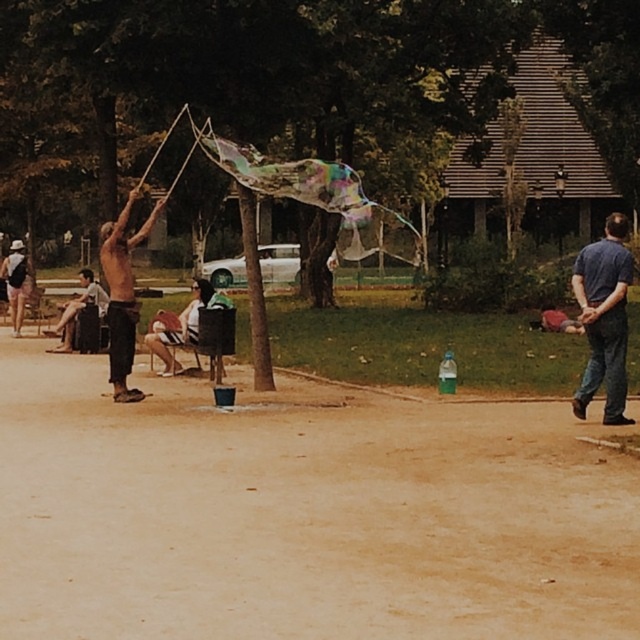
Who is positioned more to the left, brown dirt field at center or shiny black pants at left?

shiny black pants at left is more to the left.

Is brown dirt field at center taller than shiny black pants at left?

No.

Identify the location of brown dirt field at center. (304, 513).

Between point (112, 260) and point (173, 323), which one is positioned behind?

The point (173, 323) is behind.

Between shiny black pants at left and light brown fabric chair at center, which one has less height?

With less height is light brown fabric chair at center.

Who is more forward, (124, 248) or (172, 321)?

Point (124, 248)

I want to click on shiny black pants at left, so click(x=122, y=294).

Who is positioned more to the right, blue denim jeans at right or light brown fabric chair at center?

Positioned to the right is blue denim jeans at right.

Who is positioned more to the left, blue denim jeans at right or light brown fabric chair at center?

Positioned to the left is light brown fabric chair at center.

Is point (580, 284) closer to camera compared to point (168, 321)?

Yes.

You are a GUI agent. You are given a task and a screenshot of the screen. Output one action in this format:
    pyautogui.click(x=<x>, y=<y>)
    Task: Click on the blue denim jeans at right
    The height and width of the screenshot is (640, 640).
    Given the screenshot: What is the action you would take?
    pyautogui.click(x=604, y=317)